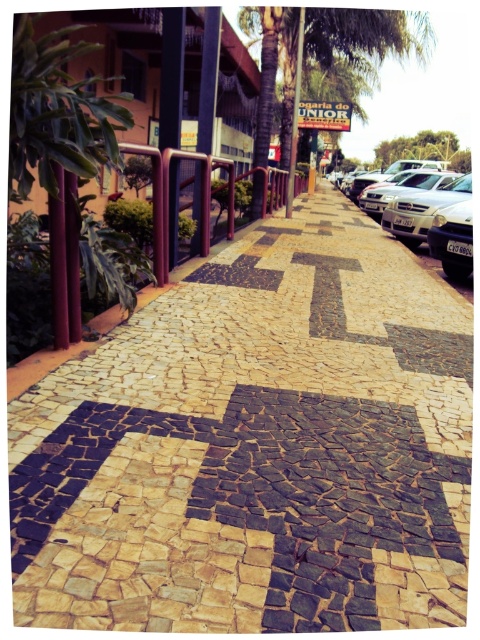
Which is below, green leafy palm tree at upper center or silver metallic car at right?

silver metallic car at right is lower down.

Can you confirm if green leafy palm tree at upper center is thinner than silver metallic car at right?

No.

Between point (350, 42) and point (420, 195), which one is positioned in front?

Point (420, 195) is more forward.

This screenshot has height=640, width=480. Find the location of `green leafy palm tree at upper center`. green leafy palm tree at upper center is located at coordinates pyautogui.click(x=323, y=51).

Does natural stone mosaic at center have a greater width compared to green leafy palm tree at upper center?

No, natural stone mosaic at center is not wider than green leafy palm tree at upper center.

Does natural stone mosaic at center appear under green leafy palm tree at upper center?

Indeed, natural stone mosaic at center is positioned under green leafy palm tree at upper center.

Who is more distant from viewer, (252, 317) or (275, 13)?

Positioned behind is point (275, 13).

The image size is (480, 640). In order to click on natural stone mosaic at center in this screenshot , I will do `click(255, 449)`.

Is natural stone mosaic at center thinner than silver metallic car at right?

Correct, natural stone mosaic at center's width is less than silver metallic car at right's.

Who is more forward, (264,246) or (444,170)?

Positioned in front is point (264,246).

Who is more distant from viewer, [177,428] or [382,225]?

The point [382,225] is behind.

Locate an element on the screen. This screenshot has width=480, height=640. natural stone mosaic at center is located at coordinates (255, 449).